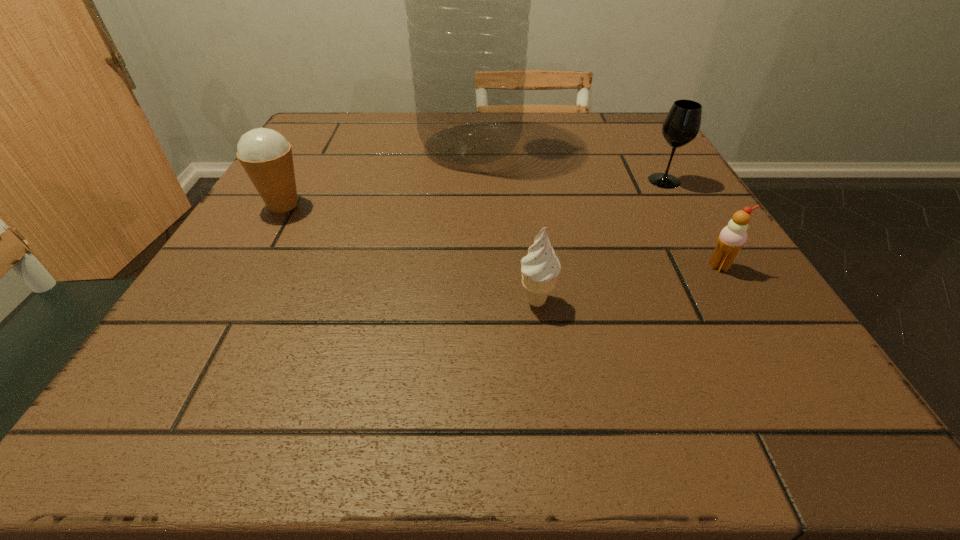
Identify the location of free space at the left edge. (300, 295).

This screenshot has width=960, height=540. In order to click on vacant area at the right edge in this screenshot , I will do (615, 170).

Where is `blank space at the far left corner of the desktop`? blank space at the far left corner of the desktop is located at coordinates (317, 144).

Locate an element on the screen. This screenshot has height=540, width=960. vacant space at the near left corner of the desktop is located at coordinates (239, 380).

The image size is (960, 540). In the image, there is a desktop. What are the coordinates of `vacant space at the far right corner` in the screenshot? It's located at (647, 143).

Image resolution: width=960 pixels, height=540 pixels. Find the location of `free space between the tallest object and the second icecream from left to right`. free space between the tallest object and the second icecream from left to right is located at coordinates (503, 224).

Where is `vacant space that's between the nearest object and the leftmost icecream`? vacant space that's between the nearest object and the leftmost icecream is located at coordinates (410, 253).

The height and width of the screenshot is (540, 960). I want to click on free space between the fourth nearest object and the nearest icecream, so click(600, 241).

This screenshot has width=960, height=540. What are the coordinates of `unoccupied area between the fourth nearest object and the second farthest icecream` in the screenshot? It's located at (x=691, y=224).

Where is `unoccupied area between the second icecream from left to right and the farthest icecream`? This screenshot has height=540, width=960. unoccupied area between the second icecream from left to right and the farthest icecream is located at coordinates (410, 253).